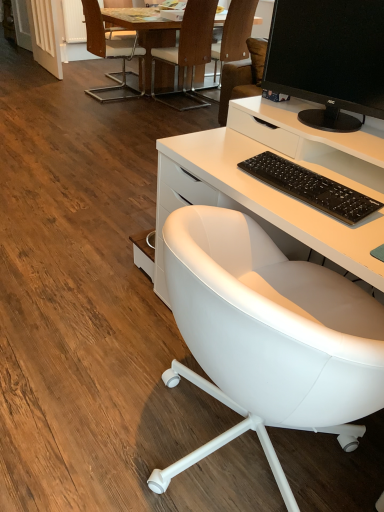
Find the location of a particular element. wooden chair at upper center, which appears as the second chair when viewed from the front is located at coordinates (188, 50).

Describe the element at coordinates (144, 33) in the screenshot. I see `wooden table at upper center` at that location.

Describe the element at coordinates (269, 336) in the screenshot. I see `white leather chair at center, the fourth chair in the back-to-front sequence` at that location.

Describe the element at coordinates (233, 36) in the screenshot. The image size is (384, 512). I see `brown leather chair at upper center, the fourth chair viewed from the front` at that location.

What do you see at coordinates (110, 53) in the screenshot? The image size is (384, 512). I see `wooden chair at upper left, the third chair in the front-to-back sequence` at bounding box center [110, 53].

Find the location of `wooden chair at upper center, which appears as the second chair when viewed from the front`. wooden chair at upper center, which appears as the second chair when viewed from the front is located at coordinates (188, 50).

Is black glossy monitor at upper right far away from wooden chair at upper left, the second chair viewed from the back?

Absolutely, black glossy monitor at upper right is distant from wooden chair at upper left, the second chair viewed from the back.

In terms of size, does black glossy monitor at upper right appear bigger or smaller than wooden chair at upper left, the third chair in the front-to-back sequence?

Considering their sizes, black glossy monitor at upper right takes up less space than wooden chair at upper left, the third chair in the front-to-back sequence.

Could you tell me if black glossy monitor at upper right is turned towards wooden chair at upper left, the second chair viewed from the back?

No, black glossy monitor at upper right is not aimed at wooden chair at upper left, the second chair viewed from the back.

Image resolution: width=384 pixels, height=512 pixels. In order to click on the 2nd chair counting from the right of the wooden chair at upper center, which appears as the second chair when viewed from the front in this screenshot , I will do `click(269, 336)`.

Could wooden chair at upper center, which appears as the second chair when viewed from the front, be considered to be inside white leather chair at center, which is the 1th chair from front to back?

No, white leather chair at center, which is the 1th chair from front to back, does not contain wooden chair at upper center, which appears as the second chair when viewed from the front.

Could you tell me if white leather chair at center, the fourth chair in the back-to-front sequence, is turned towards wooden chair at upper center, which is the 3th chair in back-to-front order?

No, white leather chair at center, the fourth chair in the back-to-front sequence, is not oriented towards wooden chair at upper center, which is the 3th chair in back-to-front order.

Between white leather chair at center, the fourth chair in the back-to-front sequence, and wooden chair at upper center, which appears as the second chair when viewed from the front, which one is positioned behind?

Positioned behind is wooden chair at upper center, which appears as the second chair when viewed from the front.

From a real-world perspective, is white leather chair at center, the fourth chair in the back-to-front sequence, under black matte keyboard at center?

Yes, from a real-world perspective, white leather chair at center, the fourth chair in the back-to-front sequence, is under black matte keyboard at center.

Is white leather chair at center, the fourth chair in the back-to-front sequence, facing away from black matte keyboard at center?

No, white leather chair at center, the fourth chair in the back-to-front sequence,'s orientation is not away from black matte keyboard at center.

Visually, is white leather chair at center, which is the 1th chair from front to back, positioned to the left or to the right of black matte keyboard at center?

Clearly, white leather chair at center, which is the 1th chair from front to back, is on the right of black matte keyboard at center in the image.

Considering the sizes of objects wooden chair at upper left, the third chair in the front-to-back sequence, and black glossy monitor at upper right in the image provided, who is thinner, wooden chair at upper left, the third chair in the front-to-back sequence, or black glossy monitor at upper right?

With smaller width is black glossy monitor at upper right.

Is black glossy monitor at upper right located within wooden chair at upper left, the second chair viewed from the back?

No, black glossy monitor at upper right is not inside wooden chair at upper left, the second chair viewed from the back.

Between wooden chair at upper left, the second chair viewed from the back, and black glossy monitor at upper right, which one has more height?

wooden chair at upper left, the second chair viewed from the back.

Considering the sizes of objects wooden chair at upper left, the second chair viewed from the back, and black glossy monitor at upper right in the image provided, who is bigger, wooden chair at upper left, the second chair viewed from the back, or black glossy monitor at upper right?

With larger size is wooden chair at upper left, the second chair viewed from the back.

From a real-world perspective, is black matte keyboard at center on wooden chair at upper left, the third chair in the front-to-back sequence?

Correct, in the physical world, black matte keyboard at center is higher than wooden chair at upper left, the third chair in the front-to-back sequence.

In terms of width, does black matte keyboard at center look wider or thinner when compared to wooden chair at upper left, the third chair in the front-to-back sequence?

Considering their sizes, black matte keyboard at center looks slimmer than wooden chair at upper left, the third chair in the front-to-back sequence.

From the image's perspective, would you say black matte keyboard at center is positioned over wooden chair at upper left, the third chair in the front-to-back sequence?

Incorrect, from the image's perspective, black matte keyboard at center is lower than wooden chair at upper left, the third chair in the front-to-back sequence.

Can we say black matte keyboard at center lies outside wooden chair at upper left, the second chair viewed from the back?

Indeed, black matte keyboard at center is completely outside wooden chair at upper left, the second chair viewed from the back.

Considering the positions of objects brown leather chair at upper center, placed as the 1th chair when sorted from back to front, and wooden chair at upper left, the third chair in the front-to-back sequence, in the image provided, who is more to the left, brown leather chair at upper center, placed as the 1th chair when sorted from back to front, or wooden chair at upper left, the third chair in the front-to-back sequence,?

wooden chair at upper left, the third chair in the front-to-back sequence.

Which is more distant, (233, 28) or (90, 17)?

The point (90, 17) is farther.

Measure the distance from brown leather chair at upper center, the fourth chair viewed from the front, to wooden chair at upper left, the third chair in the front-to-back sequence.

brown leather chair at upper center, the fourth chair viewed from the front, and wooden chair at upper left, the third chair in the front-to-back sequence, are 92.50 centimeters apart.

Looking at this image, from a real-world perspective, is brown leather chair at upper center, placed as the 1th chair when sorted from back to front, positioned above or below wooden chair at upper left, the second chair viewed from the back?

In terms of real-world spatial position, brown leather chair at upper center, placed as the 1th chair when sorted from back to front, is above wooden chair at upper left, the second chair viewed from the back.

Is wooden table at upper center not near white leather chair at center, the fourth chair in the back-to-front sequence?

Indeed, wooden table at upper center is not near white leather chair at center, the fourth chair in the back-to-front sequence.

Considering the sizes of objects wooden table at upper center and white leather chair at center, the fourth chair in the back-to-front sequence, in the image provided, who is bigger, wooden table at upper center or white leather chair at center, the fourth chair in the back-to-front sequence,?

wooden table at upper center is bigger.

From the image's perspective, which one is positioned higher, wooden table at upper center or white leather chair at center, the fourth chair in the back-to-front sequence?

wooden table at upper center appears higher in the image.

Does wooden table at upper center have a lesser width compared to white leather chair at center, the fourth chair in the back-to-front sequence?

In fact, wooden table at upper center might be wider than white leather chair at center, the fourth chair in the back-to-front sequence.

Which chair is the 2nd one when counting from the back of the black glossy monitor at upper right? Please provide its 2D coordinates.

[(110, 53)]

Find the location of a particular element. chair in front of the wooden chair at upper center, which appears as the second chair when viewed from the front is located at coordinates (269, 336).

From the picture: When comparing their distances from black glossy monitor at upper right, does wooden chair at upper left, the second chair viewed from the back, or white leather chair at center, which is the 1th chair from front to back, seem closer?

white leather chair at center, which is the 1th chair from front to back, is positioned closer to the anchor black glossy monitor at upper right.

Which object lies nearer to the anchor point wooden table at upper center, black matte keyboard at center or brown leather chair at upper center, the fourth chair viewed from the front?

brown leather chair at upper center, the fourth chair viewed from the front, lies closer to wooden table at upper center than the other object.

Estimate the real-world distances between objects in this image. Which object is further from brown leather chair at upper center, the fourth chair viewed from the front, black glossy monitor at upper right or white leather chair at center, which is the 1th chair from front to back?

white leather chair at center, which is the 1th chair from front to back.

Considering their positions, is wooden chair at upper center, which is the 3th chair in back-to-front order, positioned closer to black glossy monitor at upper right than white leather chair at center, which is the 1th chair from front to back?

white leather chair at center, which is the 1th chair from front to back.

Considering their positions, is black matte keyboard at center positioned closer to white leather chair at center, which is the 1th chair from front to back, than wooden chair at upper center, which is the 3th chair in back-to-front order?

The object closer to white leather chair at center, which is the 1th chair from front to back, is black matte keyboard at center.

Based on their spatial positions, is black matte keyboard at center or wooden chair at upper left, the second chair viewed from the back, closer to brown leather chair at upper center, placed as the 1th chair when sorted from back to front?

Based on the image, wooden chair at upper left, the second chair viewed from the back, appears to be nearer to brown leather chair at upper center, placed as the 1th chair when sorted from back to front.

Based on their spatial positions, is brown leather chair at upper center, the fourth chair viewed from the front, or wooden table at upper center closer to black glossy monitor at upper right?

brown leather chair at upper center, the fourth chair viewed from the front, is positioned closer to the anchor black glossy monitor at upper right.

Looking at the image, which one is located further to black glossy monitor at upper right, white leather chair at center, the fourth chair in the back-to-front sequence, or wooden chair at upper left, the third chair in the front-to-back sequence?

Based on the image, wooden chair at upper left, the third chair in the front-to-back sequence, appears to be further to black glossy monitor at upper right.

Where is `chair located between black glossy monitor at upper right and wooden chair at upper left, the third chair in the front-to-back sequence, in the depth direction`? The image size is (384, 512). chair located between black glossy monitor at upper right and wooden chair at upper left, the third chair in the front-to-back sequence, in the depth direction is located at coordinates (188, 50).

Identify the location of television positioned between white leather chair at center, which is the 1th chair from front to back, and brown leather chair at upper center, the fourth chair viewed from the front, from near to far. This screenshot has width=384, height=512. (328, 58).

Where is `television between black matte keyboard at center and wooden table at upper center from front to back`? Image resolution: width=384 pixels, height=512 pixels. television between black matte keyboard at center and wooden table at upper center from front to back is located at coordinates (328, 58).

Identify the location of table positioned between black glossy monitor at upper right and brown leather chair at upper center, the fourth chair viewed from the front, from near to far. This screenshot has width=384, height=512. (144, 33).